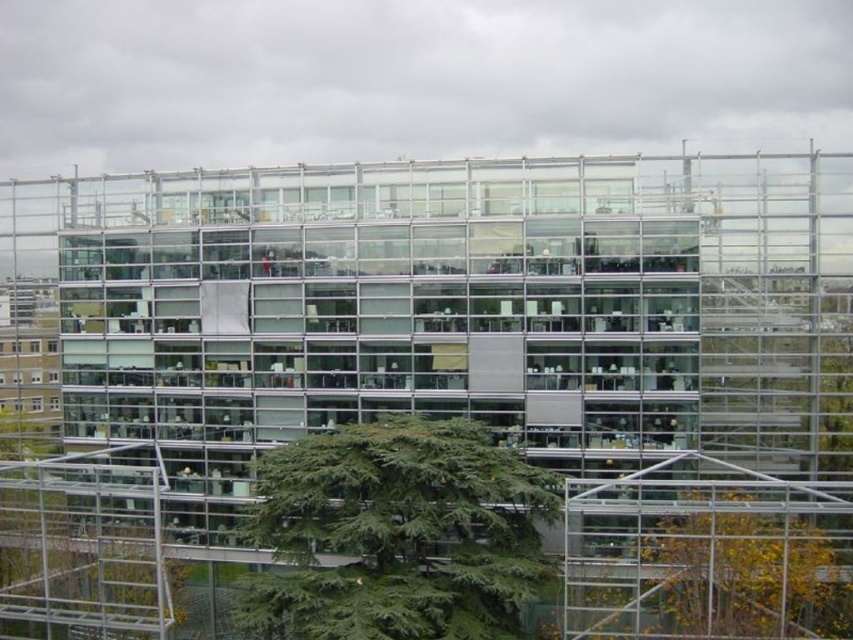
You are an architect analyzing the glass building. You notice two points on the building facade at coordinates point (518, 486) and point (722, 483). Based on their positions, which point is closer to the viewer?

Point (722, 483) is closer to the viewer because it is in front of point (518, 486) according to their spatial arrangement.